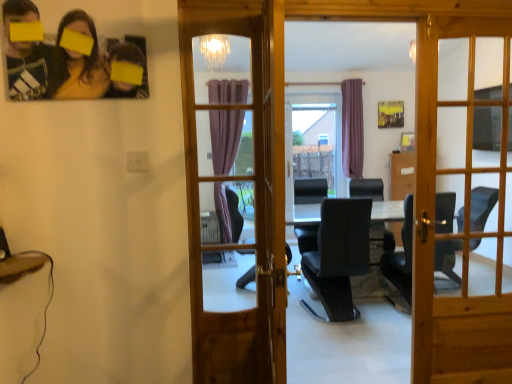
At what (x,y) coordinates should I click in order to perform the action: click on blank space situated above wooden door at center, which ranks as the 2th door in left-to-right order (from a real-world perspective). Please return your answer as a coordinate pair (x, y). The image size is (512, 384). Looking at the image, I should click on (473, 6).